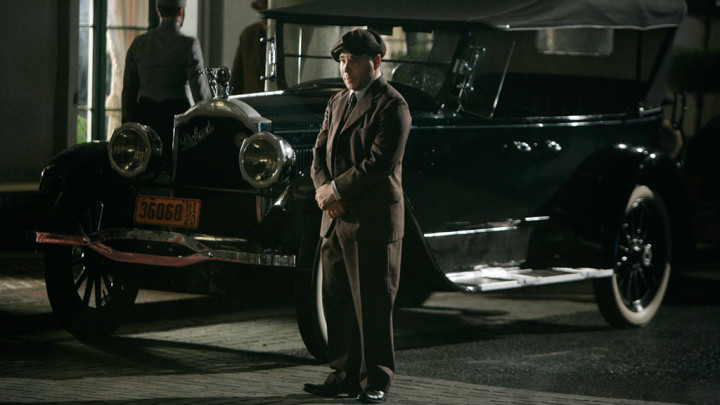
Where is `doorway`? This screenshot has width=720, height=405. doorway is located at coordinates (238, 21).